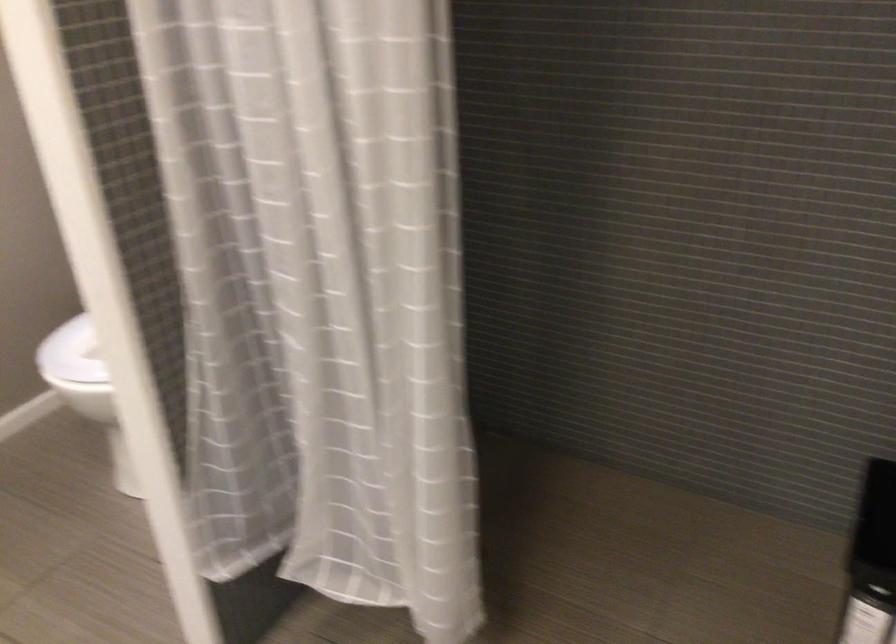
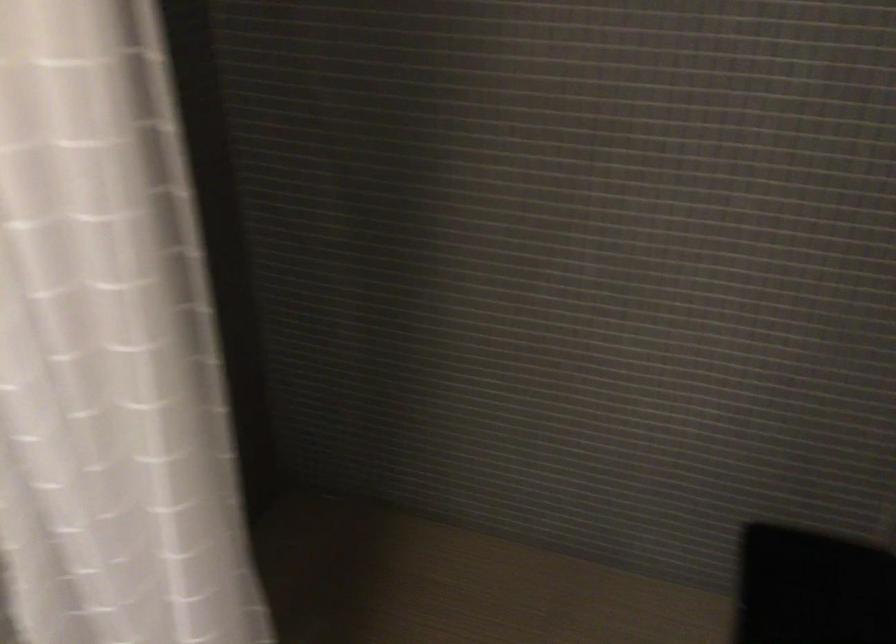
Question: The first image is from the beginning of the video and the second image is from the end. How did the camera likely rotate when shooting the video?

Choices:
 (A) Left
 (B) Right
 (C) Up
 (D) Down

Answer: (B)